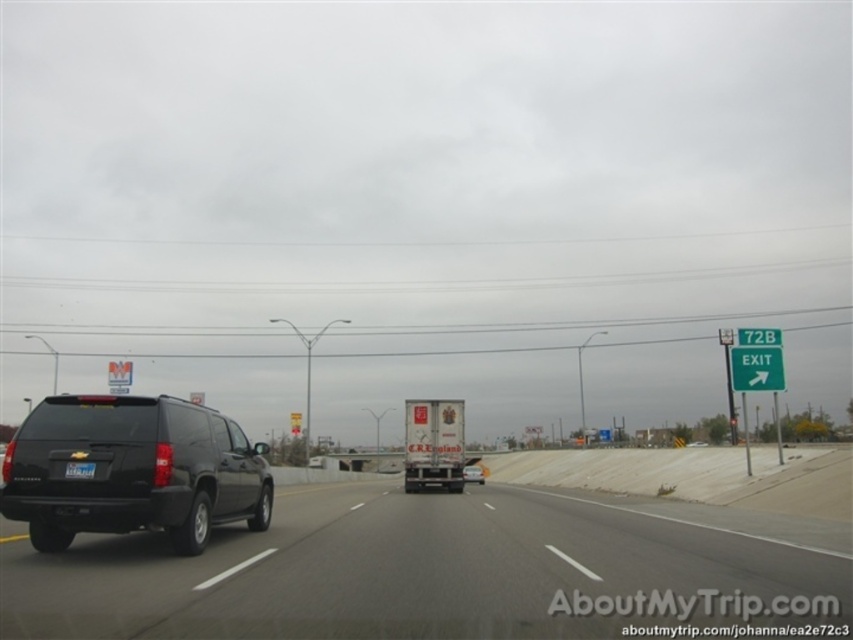
Question: Among these objects, which one is nearest to the camera?

Choices:
 (A) green plastic exit sign at upper right
 (B) matte black suv at left
 (C) black matte suv at center

Answer: (B)

Question: Which object appears closest to the camera in this image?

Choices:
 (A) white glossy truck at center
 (B) black matte suv at center

Answer: (A)

Question: Does black rubber suv at left have a greater width compared to black matte suv at center?

Choices:
 (A) no
 (B) yes

Answer: (B)

Question: From the image, what is the correct spatial relationship of matte black suv at left in relation to black plastic license plate at rear?

Choices:
 (A) right
 (B) left

Answer: (B)

Question: Observing the image, what is the correct spatial positioning of matte black suv at left in reference to black matte suv at center?

Choices:
 (A) below
 (B) above

Answer: (B)

Question: Which point is closer to the camera taking this photo?

Choices:
 (A) (704, 445)
 (B) (735, 378)
 (C) (480, 472)
 (D) (4, 461)

Answer: (D)